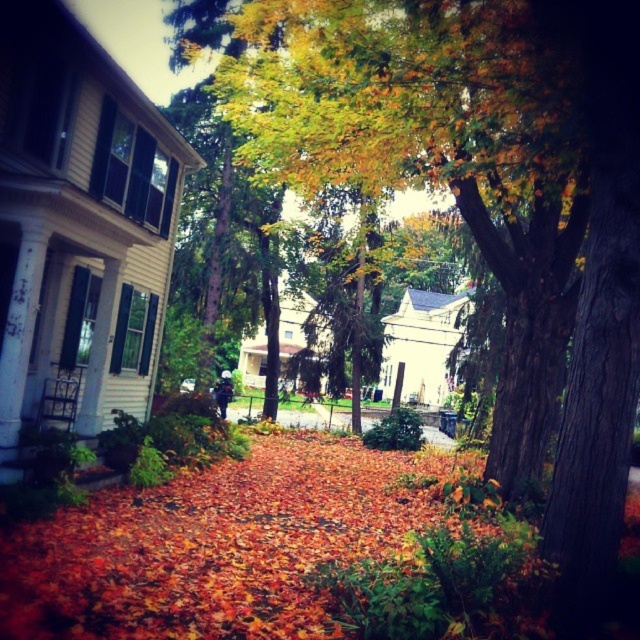
Is the position of green leafy tree at center less distant than that of autumn leaves at center?

No, green leafy tree at center is behind autumn leaves at center.

Which is in front, point (502, 1) or point (256, 481)?

Point (502, 1) is more forward.

Measure the distance between point (579, 52) and camera.

19.28 feet

The image size is (640, 640). I want to click on green leafy tree at center, so click(490, 157).